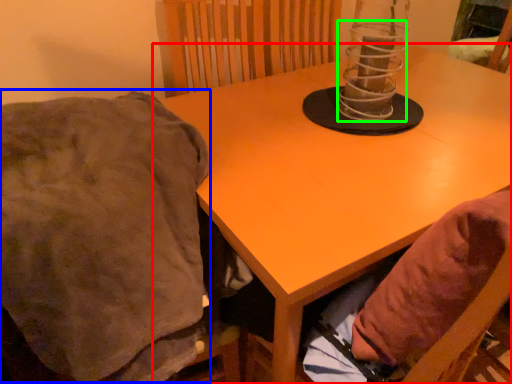
Question: Based on their relative distances, which object is farther from table (highlighted by a red box)? Choose from blanket (highlighted by a blue box) and candle holder (highlighted by a green box).

Choices:
 (A) blanket
 (B) candle holder

Answer: (A)